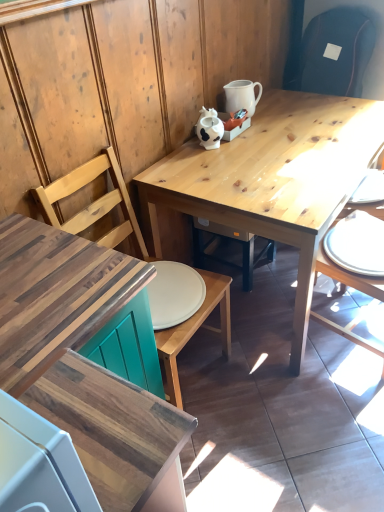
Locate an element on the screen. This screenshot has height=512, width=384. vacant space that's between wooden chair at center, acting as the 2th chair starting from the right, and natural wood table at center is located at coordinates (240, 382).